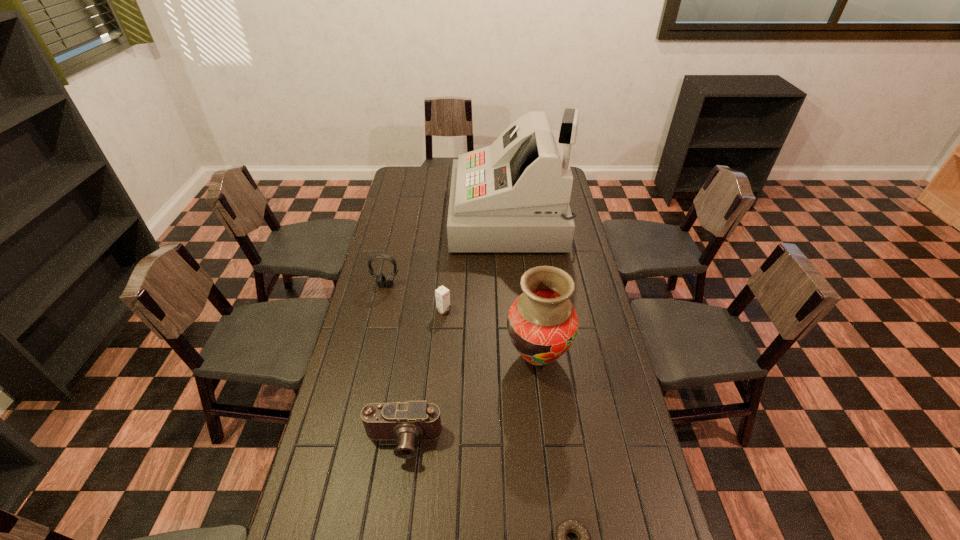
The height and width of the screenshot is (540, 960). What are the coordinates of `vacant space situated 0.110m on the keypad side of the tallest object` in the screenshot? It's located at (428, 218).

I want to click on vacant region located on the back of the vase, so click(528, 277).

Find the location of a particular element. Image resolution: width=960 pixels, height=540 pixels. free location located on the front-facing side of the fourth shortest object is located at coordinates (375, 331).

Identify the location of free space located 0.050m on the front-facing side of the camera. The image size is (960, 540). (397, 481).

Where is `blank area located on the front of the fourth nearest object`? Image resolution: width=960 pixels, height=540 pixels. blank area located on the front of the fourth nearest object is located at coordinates (441, 348).

Locate an element on the screen. This screenshot has width=960, height=540. object located at the far edge is located at coordinates (513, 196).

Where is `headset at the left edge`? The width and height of the screenshot is (960, 540). headset at the left edge is located at coordinates (381, 281).

Identify the location of camera at the left edge. Image resolution: width=960 pixels, height=540 pixels. (406, 422).

I want to click on cash register present at the right edge, so click(x=513, y=196).

Locate an element on the screen. This screenshot has height=540, width=960. vase that is at the right edge is located at coordinates (542, 323).